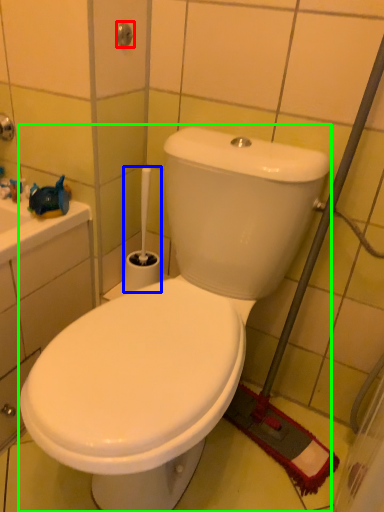
Question: Which object is the farthest from shower (highlighted by a red box)? Choose among these: brush (highlighted by a blue box) or toilet (highlighted by a green box).

Choices:
 (A) brush
 (B) toilet

Answer: (B)